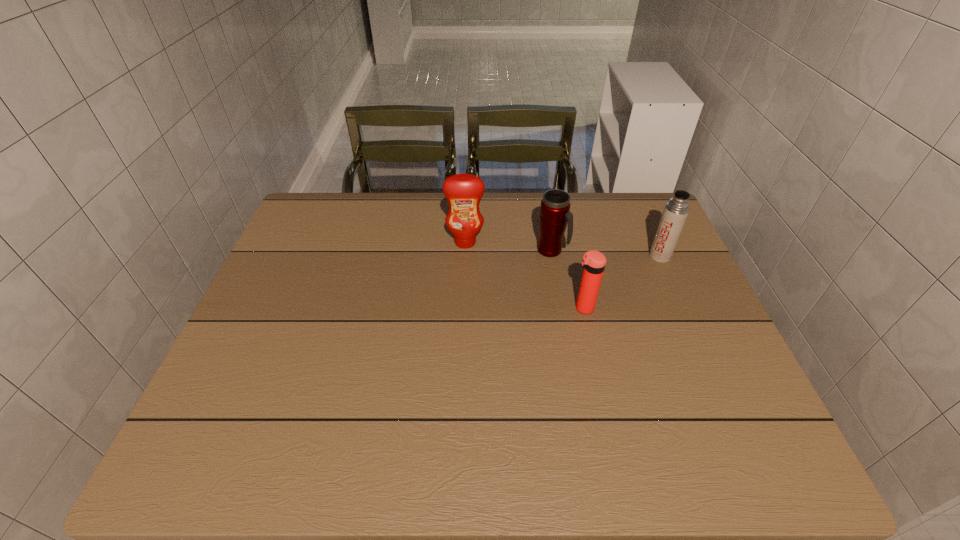
This screenshot has width=960, height=540. Find the location of `vacant space at the left edge`. vacant space at the left edge is located at coordinates (274, 335).

In order to click on vacant space at the right edge of the desktop in this screenshot , I will do `click(676, 387)`.

What are the coordinates of `vacant area between the nearest thermos bottle and the condiment` in the screenshot? It's located at (524, 275).

Locate an element on the screen. The height and width of the screenshot is (540, 960). free space between the condiment and the nearest thermos bottle is located at coordinates (524, 275).

Find the location of a particular element. The image size is (960, 540). vacant space that's between the condiment and the nearest object is located at coordinates (524, 275).

Locate an element on the screen. The image size is (960, 540). object that is the second closest to the rightmost thermos bottle is located at coordinates pos(594,262).

Identify which object is the third nearest to the condiment. Please provide its 2D coordinates. Your answer should be formatted as a tuple, i.e. [(x, y)], where the tuple contains the x and y coordinates of a point satisfying the conditions above.

[(676, 211)]

The image size is (960, 540). Identify the location of thermos bottle that is the second closest to the nearest object. (676, 211).

Point out which thermos bottle is positioned as the nearest to the nearest thermos bottle. Please provide its 2D coordinates. Your answer should be formatted as a tuple, i.e. [(x, y)], where the tuple contains the x and y coordinates of a point satisfying the conditions above.

[(555, 206)]

The width and height of the screenshot is (960, 540). In order to click on free space that satisfies the following two spatial constraints: 1. on the label side of the leftmost object; 2. on the left side of the nearest object in this screenshot , I will do (463, 308).